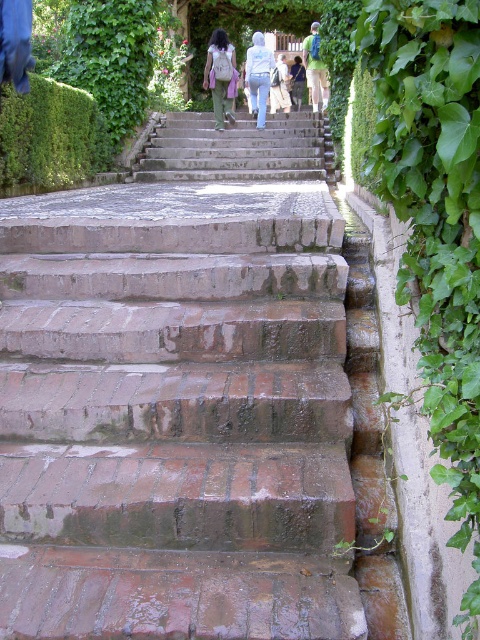
Does brown brick stairs at center have a larger size compared to light beige backpack at center?

No, brown brick stairs at center is not bigger than light beige backpack at center.

Is brown brick stairs at center to the right of light beige backpack at center from the viewer's perspective?

Correct, you'll find brown brick stairs at center to the right of light beige backpack at center.

Find the location of a particular element. The image size is (480, 640). brown brick stairs at center is located at coordinates (182, 403).

This screenshot has height=640, width=480. In order to click on brown brick stairs at center in this screenshot , I will do `click(182, 403)`.

Where is `brown brick stairs at center`? This screenshot has width=480, height=640. brown brick stairs at center is located at coordinates [x=182, y=403].

Can you confirm if green leafy hedge at upper left is shorter than green backpack at upper center?

Yes, green leafy hedge at upper left is shorter than green backpack at upper center.

Does green leafy hedge at upper left lie behind green backpack at upper center?

No, it is in front of green backpack at upper center.

The image size is (480, 640). What are the coordinates of `green leafy hedge at upper left` in the screenshot? It's located at (50, 134).